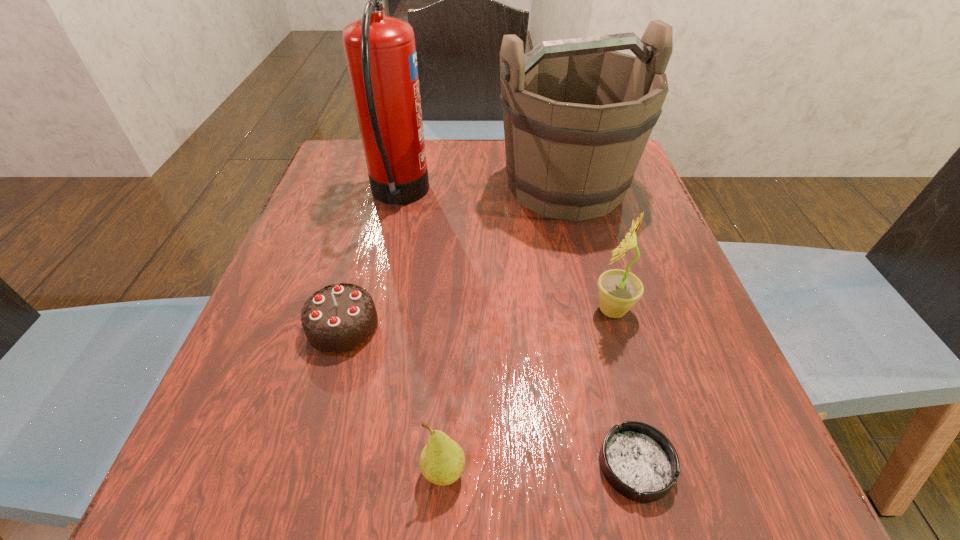
Locate an element on the screen. chocolate cake present at the left edge is located at coordinates (338, 319).

Locate an element on the screen. This screenshot has height=540, width=960. bucket located at the right edge is located at coordinates (577, 114).

The image size is (960, 540). In order to click on sunflower present at the right edge in this screenshot , I will do `click(618, 290)`.

You are a GUI agent. You are given a task and a screenshot of the screen. Output one action in this format:
    pyautogui.click(x=<x>, y=<y>)
    Task: Click on the ashtray that is at the right edge
    The width and height of the screenshot is (960, 540).
    Given the screenshot: What is the action you would take?
    pyautogui.click(x=638, y=461)

Where is `object that is at the far left corner`? This screenshot has width=960, height=540. object that is at the far left corner is located at coordinates (380, 51).

This screenshot has height=540, width=960. I want to click on object present at the far right corner, so click(577, 114).

Locate an element on the screen. This screenshot has width=960, height=540. object located at the near right corner is located at coordinates (638, 461).

In order to click on blank area at the far edge in this screenshot , I will do pyautogui.click(x=491, y=143).

Find the location of a particular element. The width and height of the screenshot is (960, 540). vacant area at the near edge is located at coordinates (608, 504).

Locate an element on the screen. This screenshot has height=540, width=960. vacant area at the left edge is located at coordinates (308, 368).